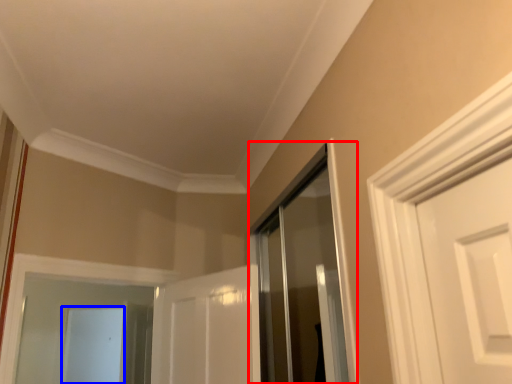
Question: Which of the following is the farthest to the observer, shower door (highlighted by a red box) or screen door (highlighted by a blue box)?

Choices:
 (A) shower door
 (B) screen door

Answer: (B)